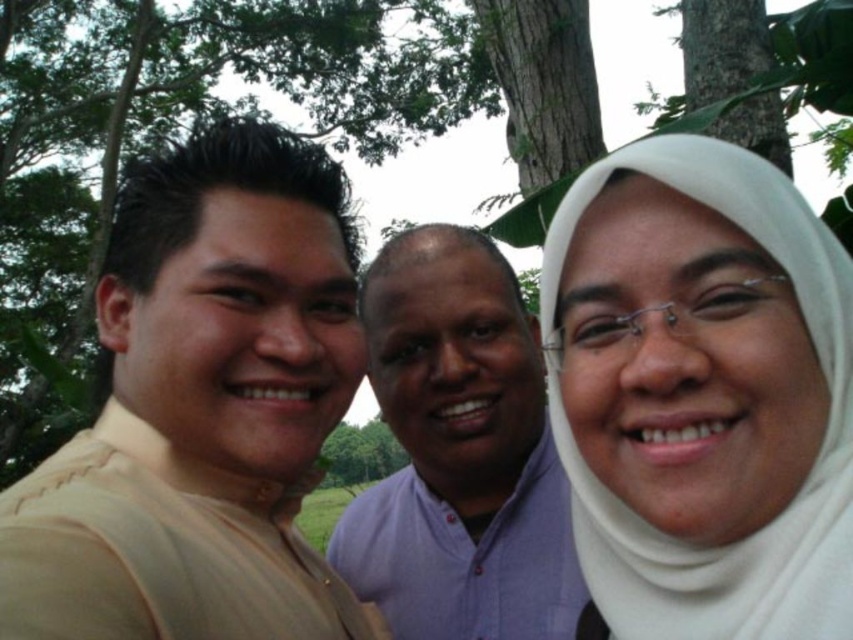
Which is in front, point (36, 294) or point (572, 492)?

Point (572, 492)

Locate an element on the screen. green leafy tree at upper center is located at coordinates (173, 134).

Is purple cotton shirt at center thinner than white matte hijab at center?

In fact, purple cotton shirt at center might be wider than white matte hijab at center.

Where is `purple cotton shirt at center`? purple cotton shirt at center is located at coordinates (459, 452).

Does green leafy tree at upper center have a lesser height compared to purple cotton shirt at center?

Incorrect, green leafy tree at upper center's height does not fall short of purple cotton shirt at center's.

Which is behind, point (408, 122) or point (521, 516)?

Point (408, 122)

You are a GUI agent. You are given a task and a screenshot of the screen. Output one action in this format:
    pyautogui.click(x=<x>, y=<y>)
    Task: Click on the green leafy tree at upper center
    
    Given the screenshot: What is the action you would take?
    pyautogui.click(x=173, y=134)